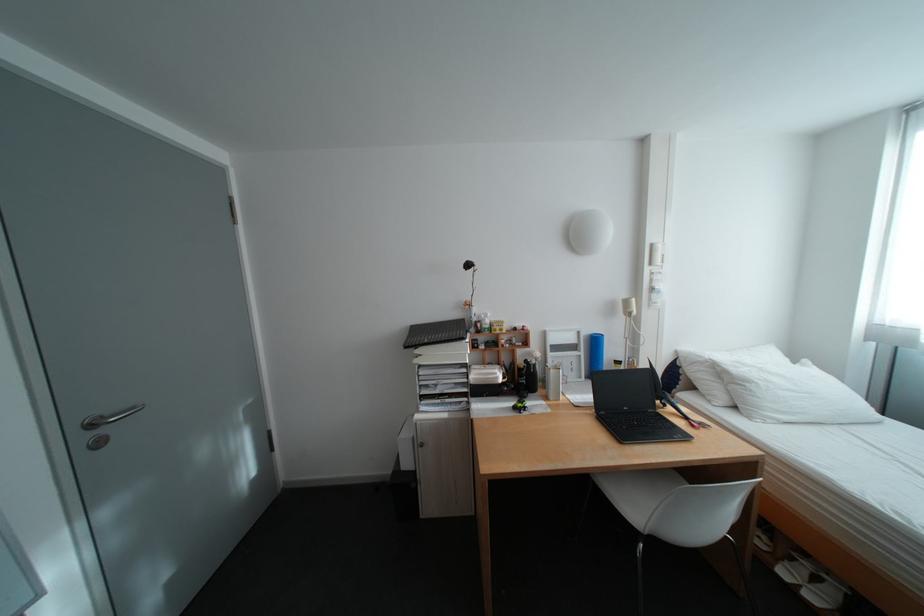
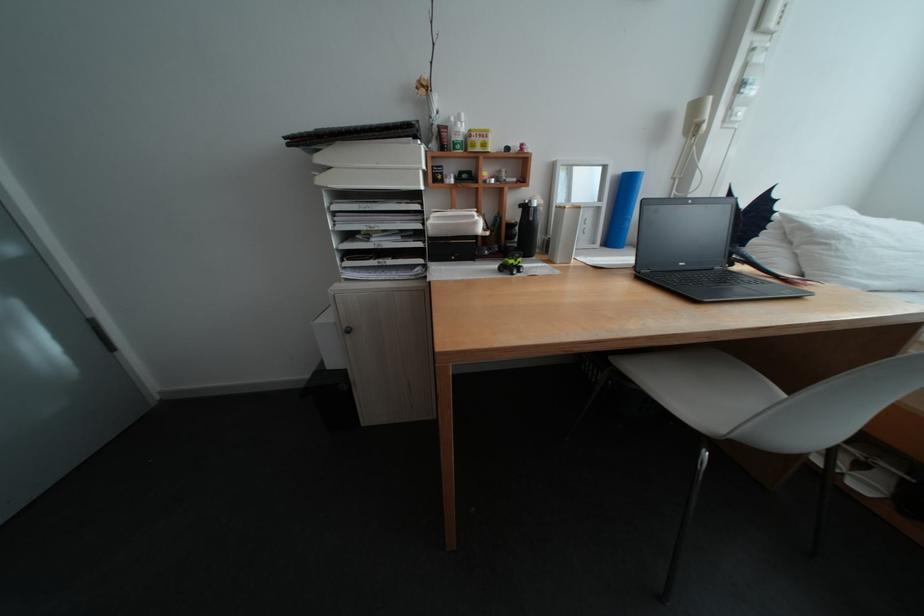
Where in the second image is the point corresponding to the point at 430,352 from the first image?

(333, 160)